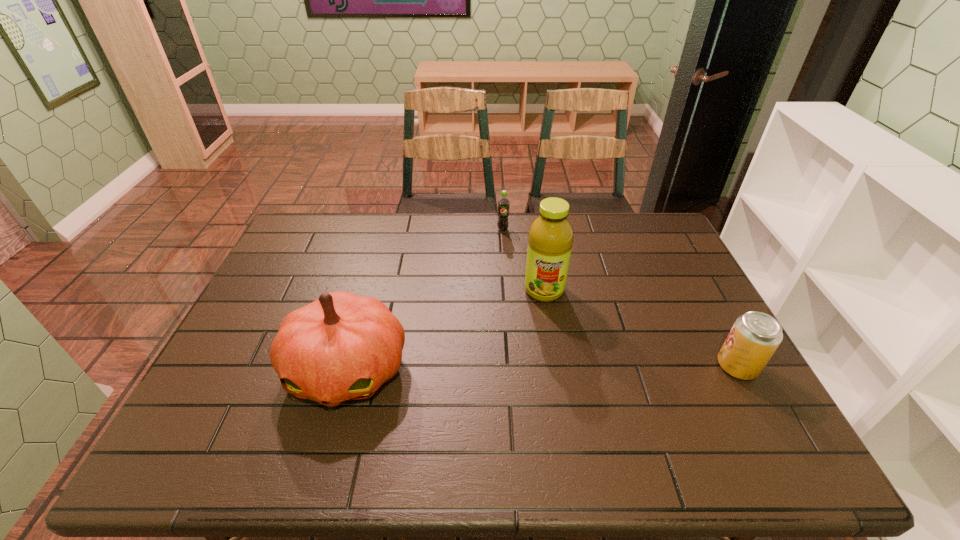
Where is `free space on the desktop that is between the pumpkin and the rightmost object and is positioned on the front label of the second object from right to left`? This screenshot has height=540, width=960. free space on the desktop that is between the pumpkin and the rightmost object and is positioned on the front label of the second object from right to left is located at coordinates (540, 368).

I want to click on free space on the desktop that is between the leftmost object and the nearer soda and is positioned on the front label of the farthest object, so click(x=510, y=368).